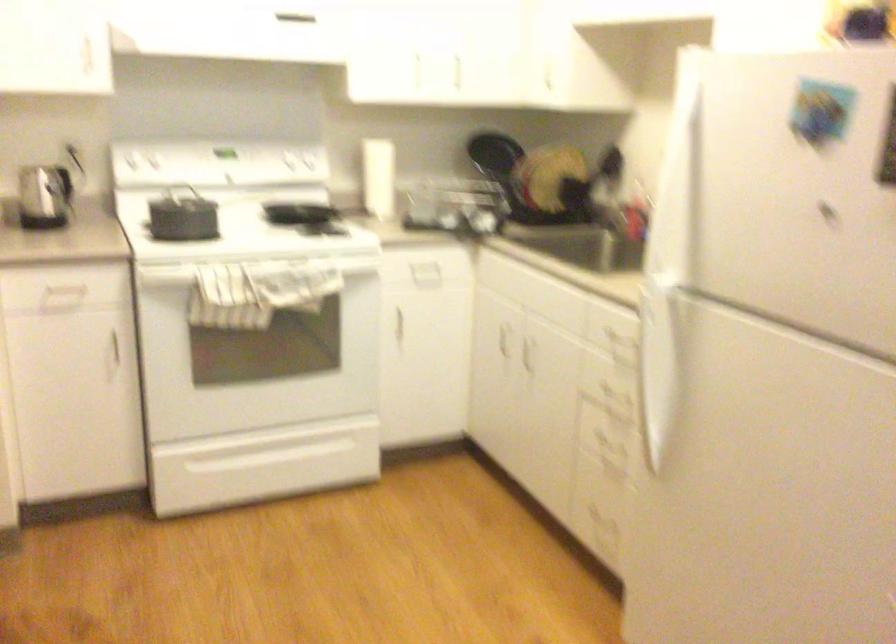
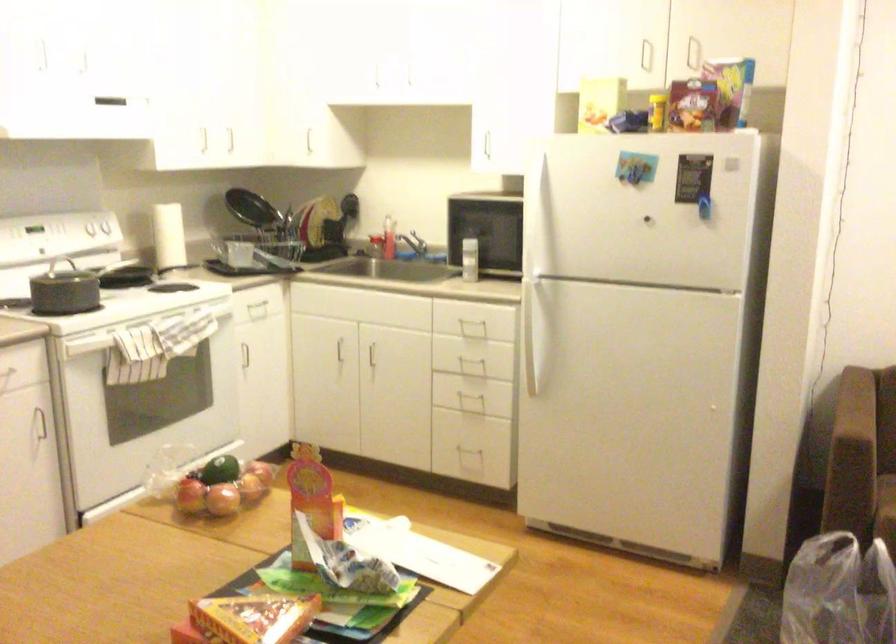
Where in the second image is the point corresponding to (x=437, y=67) from the first image?

(229, 140)